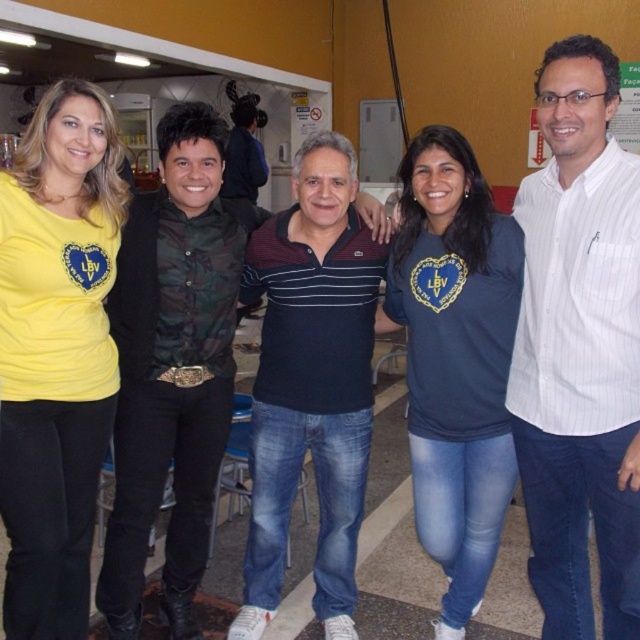
You are standing at the entrance of the room and want to greet the group. The white striped shirt at center is represented by point [579,346]. Where should you walk to approach the group?

The white striped shirt at center is located at point [579,346], so you should walk towards that coordinate to approach the group.